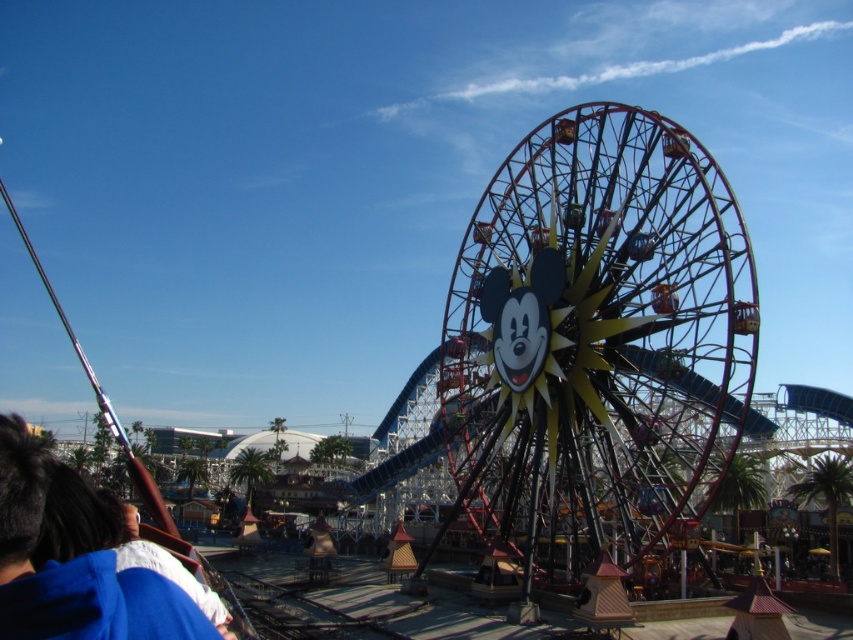
Where is `metallic ferris wheel at center`? metallic ferris wheel at center is located at coordinates (596, 340).

Between point (514, 426) and point (26, 570), which one is positioned behind?

Point (514, 426)

Identify the location of metallic ferris wheel at center. This screenshot has width=853, height=640. (596, 340).